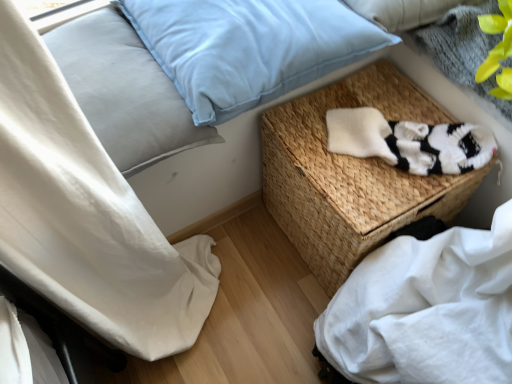
Locate an element on the screen. free spot above woven wicker basket at center (from a real-world perspective) is located at coordinates (373, 139).